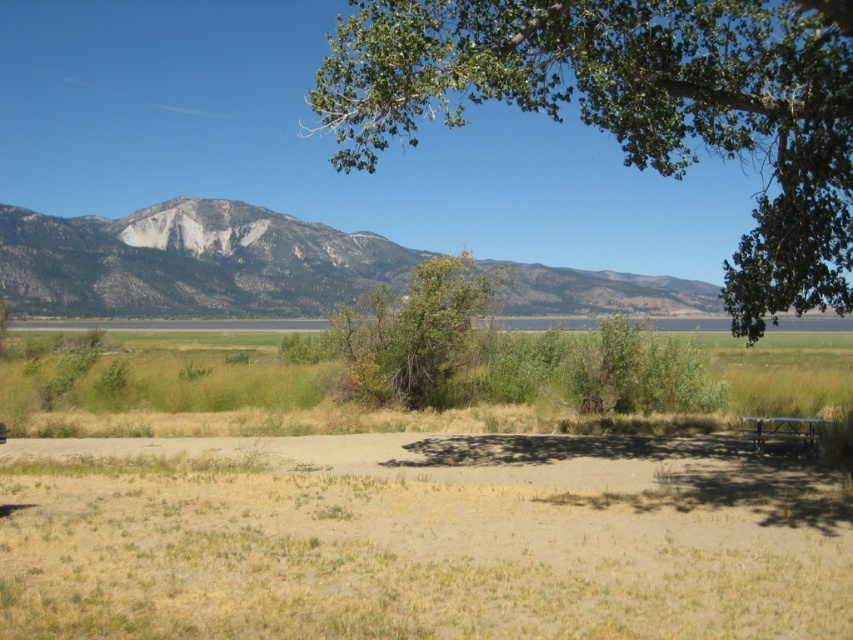
Question: In this image, where is rocky gray mountain at center located relative to metallic silver picnic table at lower right?

Choices:
 (A) above
 (B) below

Answer: (A)

Question: Which of the following is the farthest from the observer?

Choices:
 (A) (804, 189)
 (B) (805, 442)

Answer: (A)

Question: From the image, what is the correct spatial relationship of green leafy tree at center in relation to metallic silver picnic table at lower right?

Choices:
 (A) left
 (B) right

Answer: (A)

Question: Among these objects, which one is nearest to the camera?

Choices:
 (A) brown sandy dirt at lower center
 (B) rocky gray mountain at center

Answer: (A)

Question: Does green leafy tree at upper center come behind rocky gray mountain at center?

Choices:
 (A) no
 (B) yes

Answer: (A)

Question: Which of the following is the farthest from the observer?

Choices:
 (A) green leafy tree at upper center
 (B) rocky gray mountain at center
 (C) green leafy tree at center

Answer: (B)